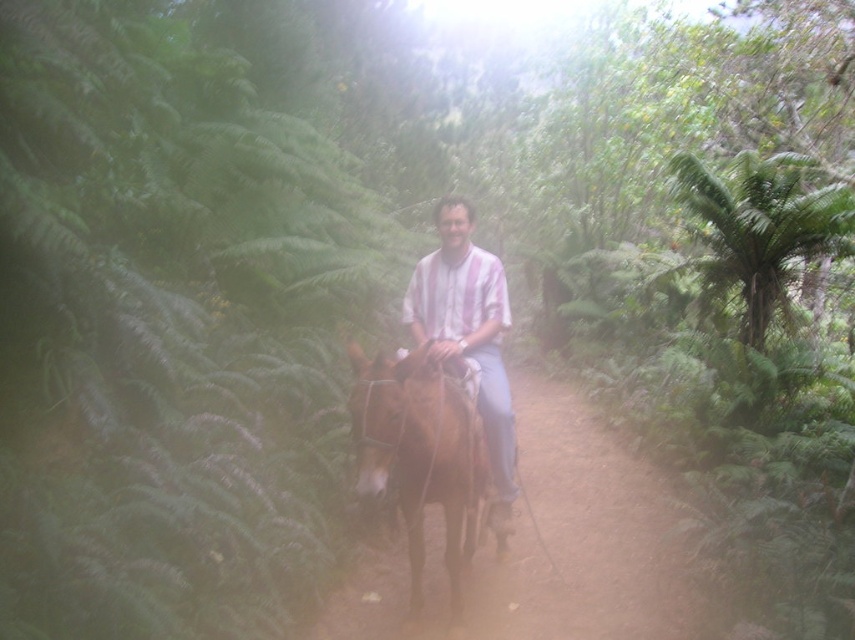
Question: From the image, what is the correct spatial relationship of brown glossy horse at center in relation to matte striped shirt at center?

Choices:
 (A) right
 (B) left

Answer: (B)

Question: Observing the image, what is the correct spatial positioning of brown glossy horse at center in reference to matte striped shirt at center?

Choices:
 (A) right
 (B) left

Answer: (B)

Question: Does brown glossy horse at center appear under matte striped shirt at center?

Choices:
 (A) yes
 (B) no

Answer: (A)

Question: Which point is closer to the camera taking this photo?

Choices:
 (A) (485, 268)
 (B) (475, 545)

Answer: (A)